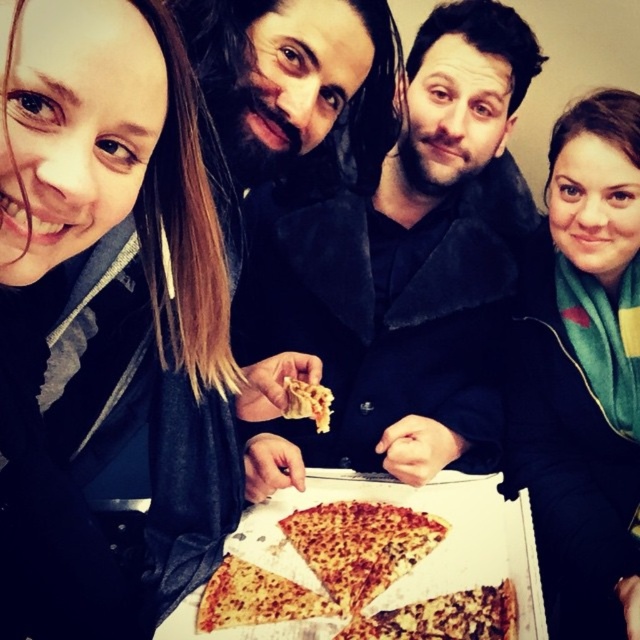
You are standing in front of the table with the partially eaten pizza box. There are two points marked on the table surface. One is at coordinate point (636,275) and the other is at point (260,568). Which of these two points is closer to you?

Point (636,275) is further to the camera than point (260,568), so the point at (260,568) is closer to you.

You are standing at the origin point. You want to move towards the pizza box located at point (291, 406). However, there is an obstacle at point (538, 484). Will you be able to reach the pizza box without going around the obstacle?

Point (538, 484) is behind point (291, 406), so the obstacle is behind the pizza box. Therefore, you can reach the pizza box without needing to go around the obstacle.

You are a photographer standing at a distance of 50 centimeters from the group. You want to take a closeup shot of the matte black scarf at upper left without moving the camera. Is the current distance sufficient?

The matte black scarf at upper left is 44.04 centimeters from the camera, so yes, the current distance of 50 centimeters is sufficient to take a closeup shot without moving the camera.